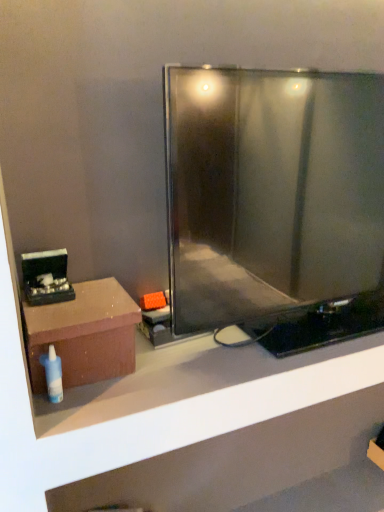
At what (x,y) coordinates should I click in order to perform the action: click on free space between metallic flat-screen tv at center and white plastic bottle at lower left. Please return your answer as a coordinate pair (x, y). Image resolution: width=384 pixels, height=512 pixels. Looking at the image, I should click on (144, 379).